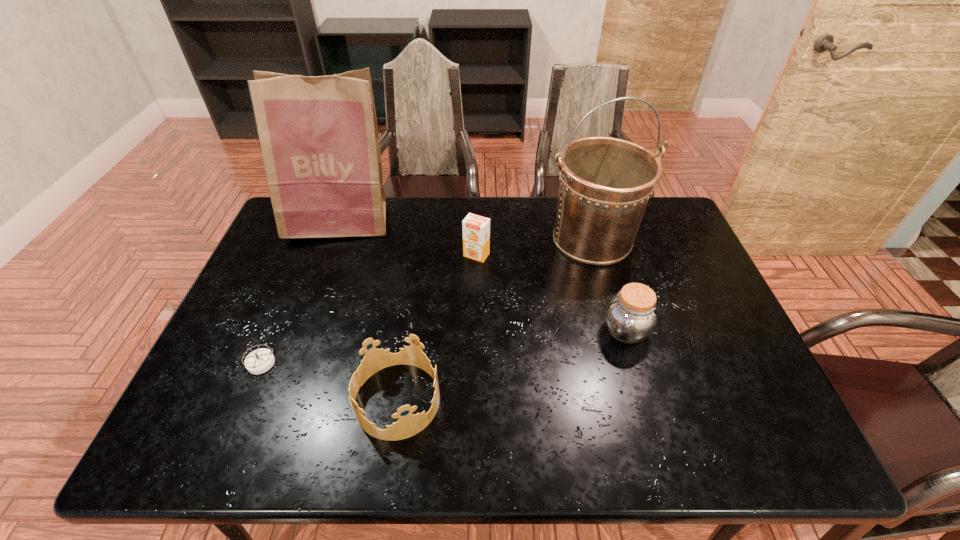
Identify the location of grocery bag. (318, 135).

You are a GUI agent. You are given a task and a screenshot of the screen. Output one action in this format:
    pyautogui.click(x=<x>, y=<y>)
    Task: Click on the bucket
    This screenshot has height=540, width=960.
    Given the screenshot: What is the action you would take?
    pyautogui.click(x=605, y=183)

What are the coordinates of `orange juice` in the screenshot? It's located at (476, 229).

At what (x,y) coordinates should I click in order to perform the action: click on jar. Please return your answer as a coordinate pair (x, y). The image size is (960, 540). Looking at the image, I should click on (631, 316).

Locate an element on the screen. tiara is located at coordinates (408, 425).

Image resolution: width=960 pixels, height=540 pixels. I want to click on compass, so click(x=259, y=361).

I want to click on blank space located 0.060m on the front-facing side of the grocery bag, so click(326, 258).

Image resolution: width=960 pixels, height=540 pixels. Find the location of `free location located on the left of the bucket`. free location located on the left of the bucket is located at coordinates (476, 239).

What are the coordinates of `vacant position located 0.330m on the front of the orange juice` in the screenshot? It's located at (476, 354).

Image resolution: width=960 pixels, height=540 pixels. Find the location of `vacant space located 0.110m on the right of the jar`. vacant space located 0.110m on the right of the jar is located at coordinates (693, 331).